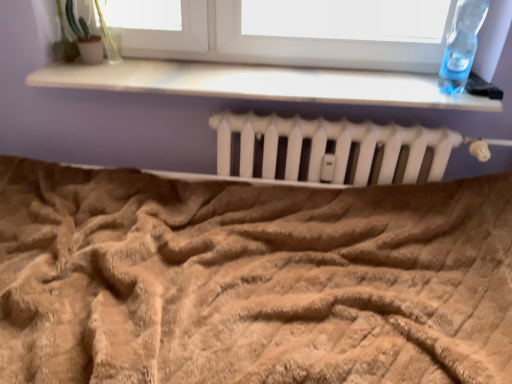
Question: From the image's perspective, is green matte plant at upper left located above beige textured blanket at center?

Choices:
 (A) yes
 (B) no

Answer: (A)

Question: Does green matte plant at upper left touch beige textured blanket at center?

Choices:
 (A) no
 (B) yes

Answer: (A)

Question: Is green matte plant at upper left shorter than beige textured blanket at center?

Choices:
 (A) no
 (B) yes

Answer: (A)

Question: Does green matte plant at upper left turn towards beige textured blanket at center?

Choices:
 (A) no
 (B) yes

Answer: (A)

Question: Does green matte plant at upper left have a larger size compared to beige textured blanket at center?

Choices:
 (A) no
 (B) yes

Answer: (A)

Question: Does green matte plant at upper left appear on the right side of beige textured blanket at center?

Choices:
 (A) yes
 (B) no

Answer: (B)

Question: From the image's perspective, is beige textured blanket at center over white matte radiator at center?

Choices:
 (A) no
 (B) yes

Answer: (A)

Question: From a real-world perspective, is beige textured blanket at center beneath white matte radiator at center?

Choices:
 (A) no
 (B) yes

Answer: (B)

Question: From the image's perspective, does beige textured blanket at center appear lower than white matte radiator at center?

Choices:
 (A) no
 (B) yes

Answer: (B)

Question: Does beige textured blanket at center have a greater width compared to white matte radiator at center?

Choices:
 (A) yes
 (B) no

Answer: (A)

Question: Is beige textured blanket at center further to the viewer compared to white matte radiator at center?

Choices:
 (A) yes
 (B) no

Answer: (B)

Question: From a real-world perspective, is beige textured blanket at center located higher than white matte radiator at center?

Choices:
 (A) yes
 (B) no

Answer: (B)

Question: Can you confirm if transparent plastic bottle at upper right is positioned to the left of white matte radiator at center?

Choices:
 (A) no
 (B) yes

Answer: (A)